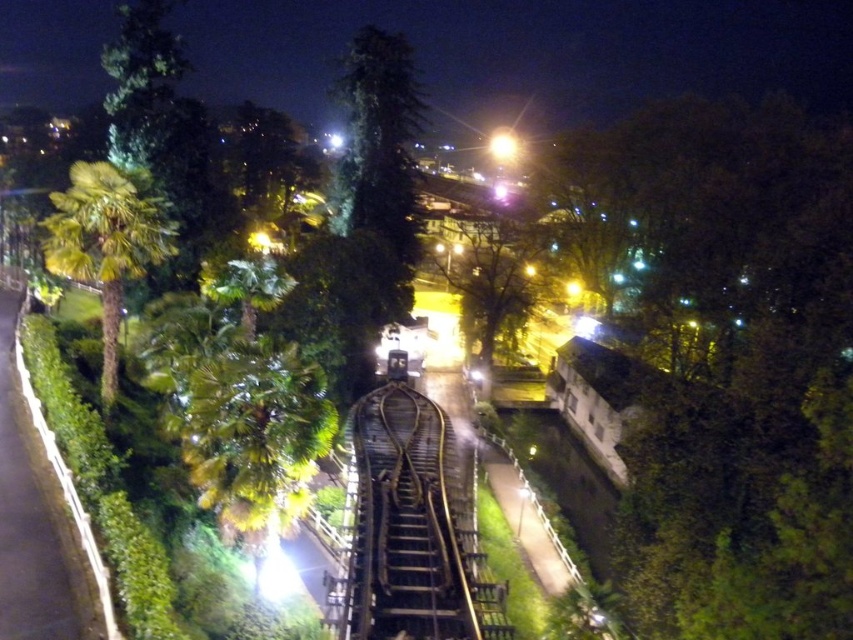
Question: Among these objects, which one is farthest from the camera?

Choices:
 (A) green leafy palm tree at left
 (B) wooden at center

Answer: (A)

Question: Does wooden at center appear over green leafy palm tree at left?

Choices:
 (A) yes
 (B) no

Answer: (B)

Question: Can you confirm if wooden at center is positioned above green leafy palm tree at left?

Choices:
 (A) no
 (B) yes

Answer: (A)

Question: Does wooden at center appear on the left side of green leafy palm tree at left?

Choices:
 (A) no
 (B) yes

Answer: (A)

Question: Which of the following is the closest to the observer?

Choices:
 (A) (138, 244)
 (B) (416, 595)

Answer: (B)

Question: Which of the following is the farthest from the observer?

Choices:
 (A) (399, 621)
 (B) (106, 372)

Answer: (B)